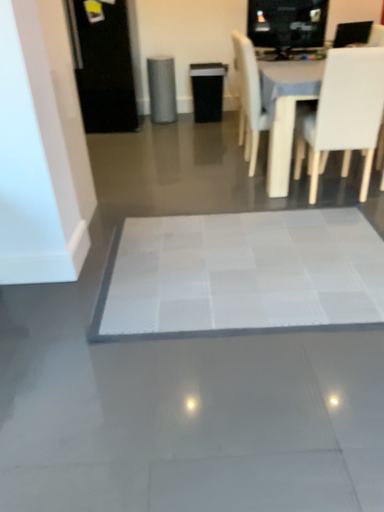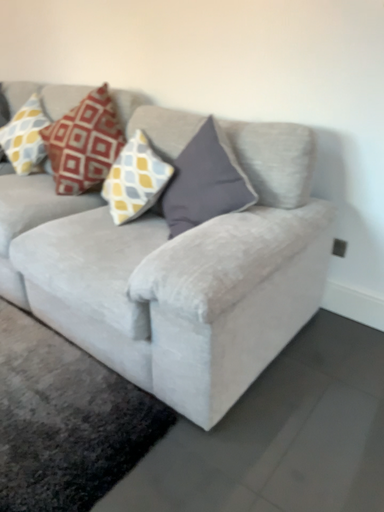
Question: How did the camera likely rotate when shooting the video?

Choices:
 (A) rotated left
 (B) rotated right

Answer: (A)